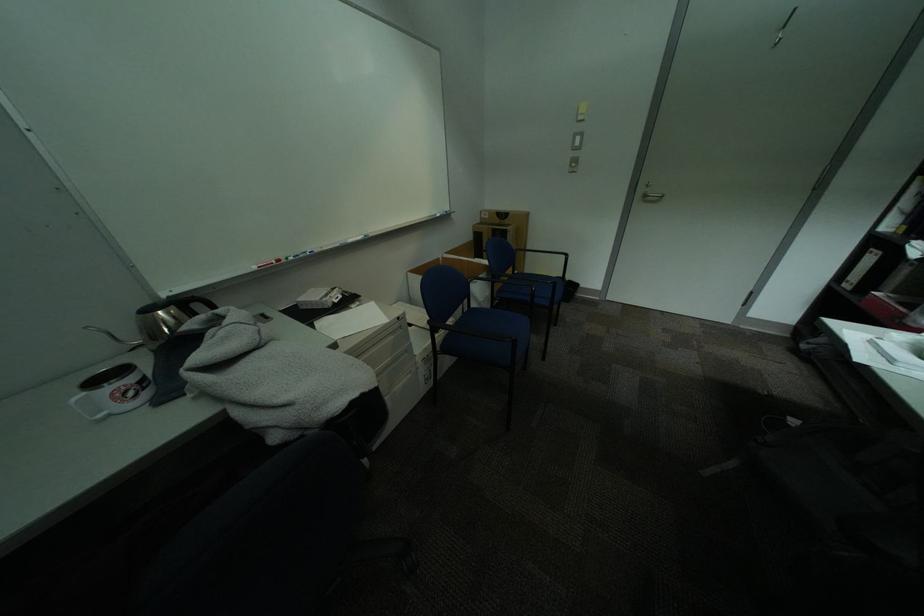
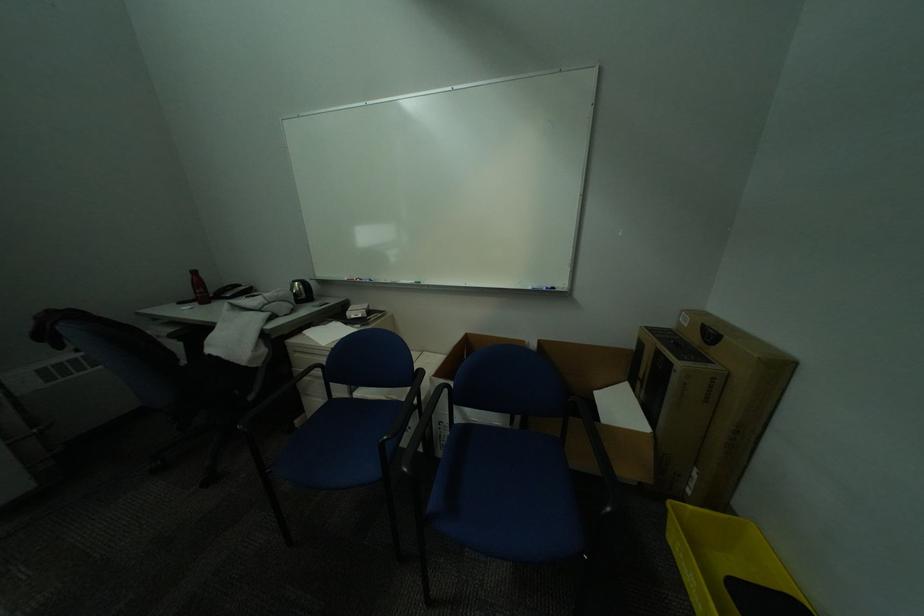
Locate, in the second image, the point that corresponds to [492,217] in the first image.

(691, 321)